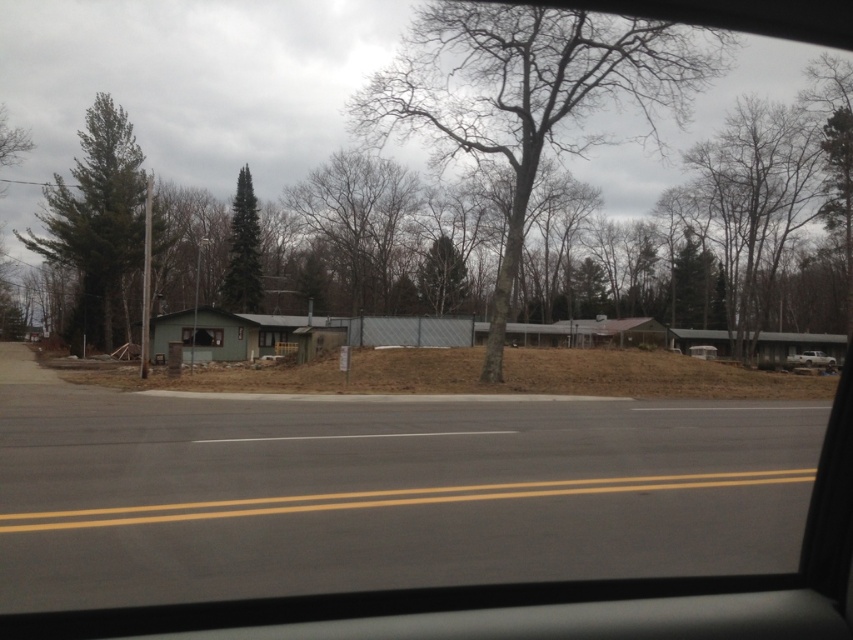
You are a passenger in a car and you see a bare wood tree at center and a bare branches at center outside the window. Which one is more to the right?

The bare wood tree at center is positioned on the right side of bare branches at center, so it is more to the right.

You are a passenger in a car and looking out the window. You see a bare wood tree at center and bare branches at center. Which one is taller?

The bare wood tree at center is taller than the bare branches at center.

You are a driver in a car and you see a bare wood tree at center and a white matte truck at right through the car window. Which object is taller when viewed from your perspective inside the car?

The bare wood tree at center is taller than the white matte truck at right.